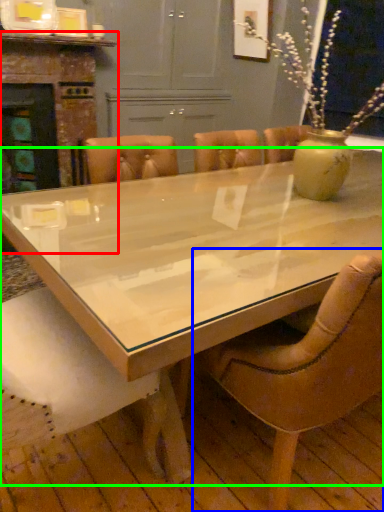
Question: Based on their relative distances, which object is farther from fireplace (highlighted by a red box)? Choose from chair (highlighted by a blue box) and coffee table (highlighted by a green box).

Choices:
 (A) chair
 (B) coffee table

Answer: (A)